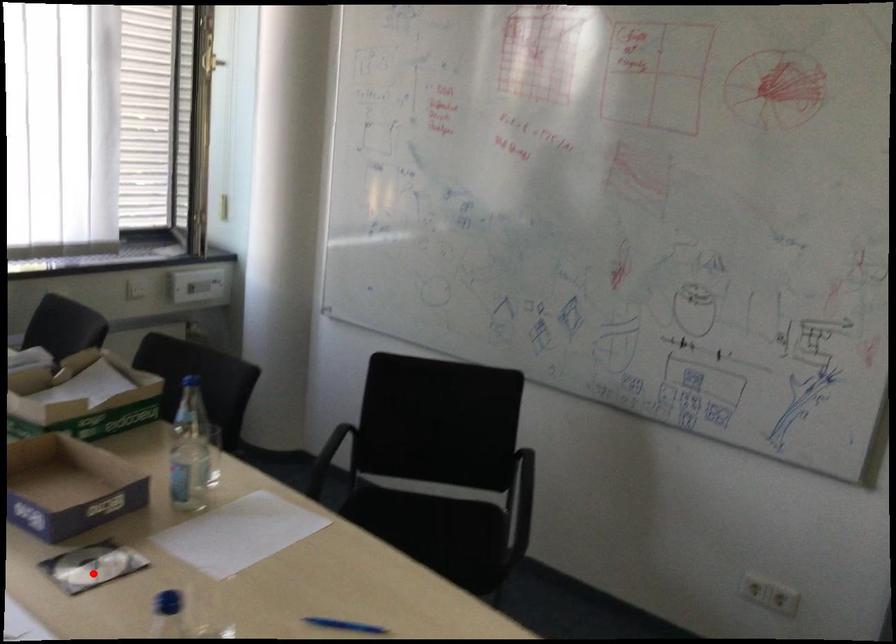
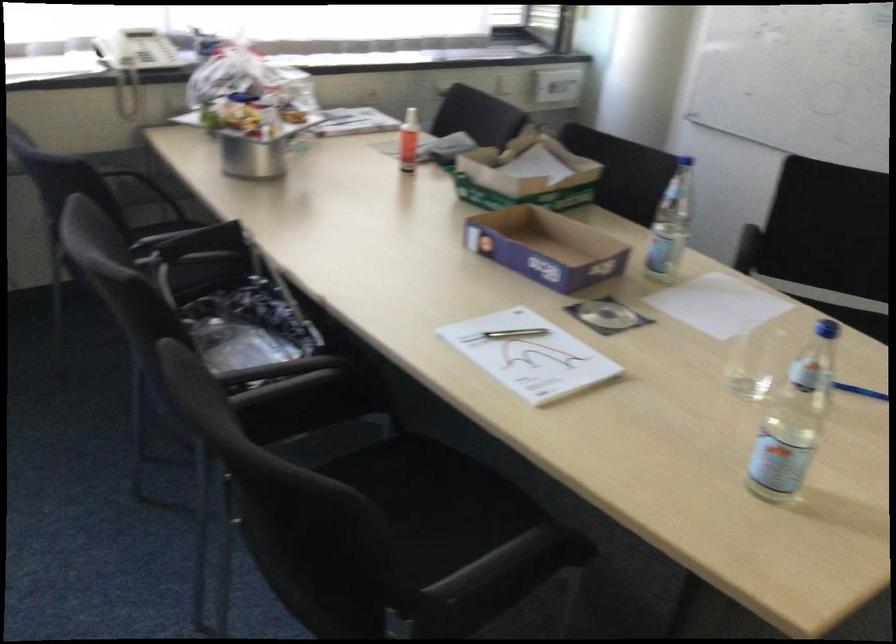
Find the pixel in the second image that matches the highlighted location in the first image.

(606, 315)